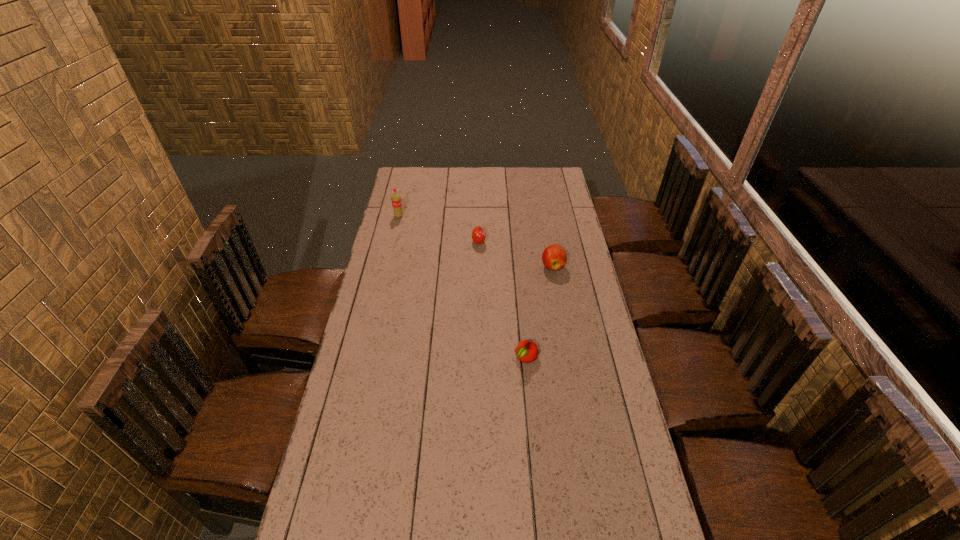
Locate an element on the screen. The width and height of the screenshot is (960, 540). free area in between the soda and the second tallest apple is located at coordinates (439, 230).

The width and height of the screenshot is (960, 540). Find the location of `vacant area between the third nearest object and the tallest apple`. vacant area between the third nearest object and the tallest apple is located at coordinates (516, 254).

Locate an element on the screen. The image size is (960, 540). free space between the shortest object and the rightmost object is located at coordinates (540, 312).

Find the location of a particular element. empty location between the second nearest object and the nearest object is located at coordinates (540, 312).

Identify which object is located as the nearest to the shortest apple. Please provide its 2D coordinates. Your answer should be formatted as a tuple, i.e. [(x, y)], where the tuple contains the x and y coordinates of a point satisfying the conditions above.

[(554, 257)]

Where is `the third closest object to the leftmost object`? Image resolution: width=960 pixels, height=540 pixels. the third closest object to the leftmost object is located at coordinates (526, 351).

Identify which apple is located as the second nearest to the leftmost object. Please provide its 2D coordinates. Your answer should be formatted as a tuple, i.e. [(x, y)], where the tuple contains the x and y coordinates of a point satisfying the conditions above.

[(554, 257)]

Where is `apple that is the second closest to the leftmost apple`? Image resolution: width=960 pixels, height=540 pixels. apple that is the second closest to the leftmost apple is located at coordinates (526, 351).

Find the location of a particular element. free location that satisfies the following two spatial constraints: 1. on the front side of the second object from right to left; 2. on the left side of the farthest object is located at coordinates (366, 358).

At what (x,y) coordinates should I click in order to perform the action: click on vacant region that satisfies the following two spatial constraints: 1. on the front side of the second apple from right to left; 2. on the right side of the farthest object. Please return your answer as a coordinate pair (x, y). Looking at the image, I should click on (366, 358).